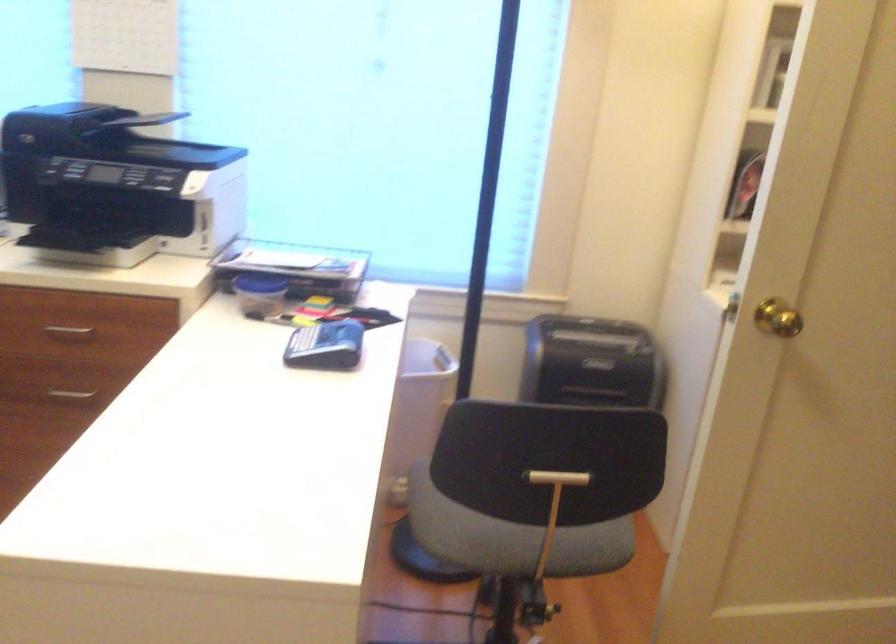
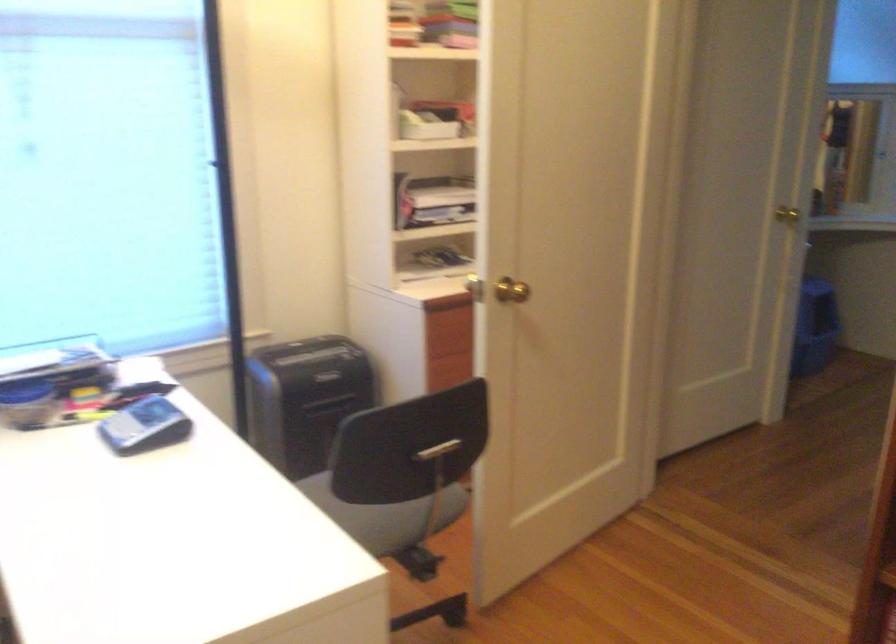
The point at (530, 527) is marked in the first image. Where is the corresponding point in the second image?

(383, 515)